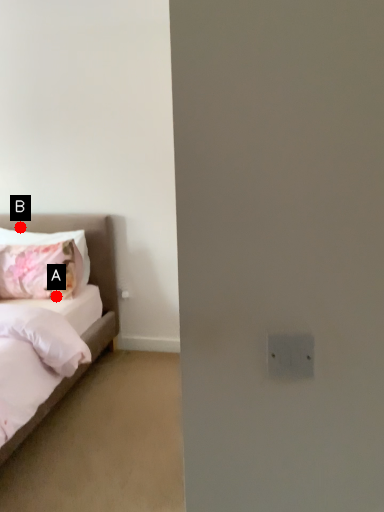
Question: Two points are circled on the image, labeled by A and B beside each circle. Which point appears farthest from the camera in this image?

Choices:
 (A) A is further
 (B) B is further

Answer: (B)